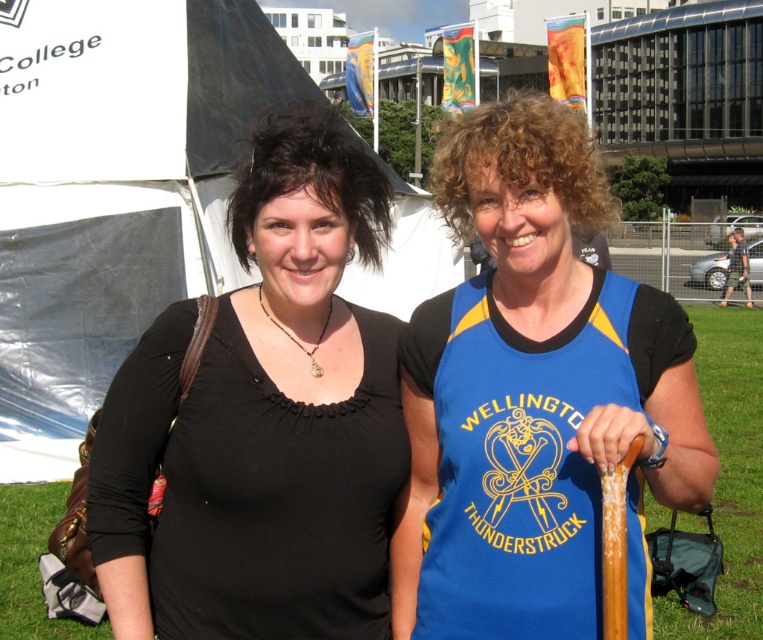
Question: Is blue jersey at center thinner than white fabric tent at upper left?

Choices:
 (A) yes
 (B) no

Answer: (A)

Question: Among these objects, which one is farthest from the camera?

Choices:
 (A) green grass at lower left
 (B) white fabric tent at upper left
 (C) black matte shirt at center
 (D) blue jersey at center

Answer: (B)

Question: Which point is closer to the camera taking this photo?

Choices:
 (A) (36, 600)
 (B) (359, 401)
 (C) (246, 276)

Answer: (B)

Question: Is blue jersey at center smaller than white fabric tent at upper left?

Choices:
 (A) yes
 (B) no

Answer: (A)

Question: In this image, where is white fabric tent at upper left located relative to green grass at lower left?

Choices:
 (A) below
 (B) above

Answer: (B)

Question: Based on their relative distances, which object is farther from the green grass at lower left?

Choices:
 (A) white fabric tent at upper left
 (B) blue jersey at center
 (C) black matte shirt at center

Answer: (B)